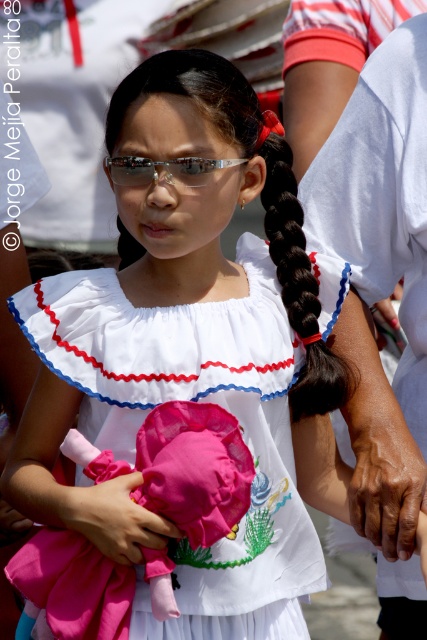
You are a photographer at a cultural event. You need to capture a photo of the girl in the white cotton dress at center and the dry skin at lower right. Which object is taller in the image?

The white cotton dress at center is taller than the dry skin at lower right.

You are a photographer at the event and want to capture the girl holding the pink fabric item. Since the white cotton dress at center and shiny metallic sunglasses at center are both in the frame, which one is located to the right of the other?

The white cotton dress at center is positioned on the right side of the shiny metallic sunglasses at center, so the dress is to the right of the sunglasses.